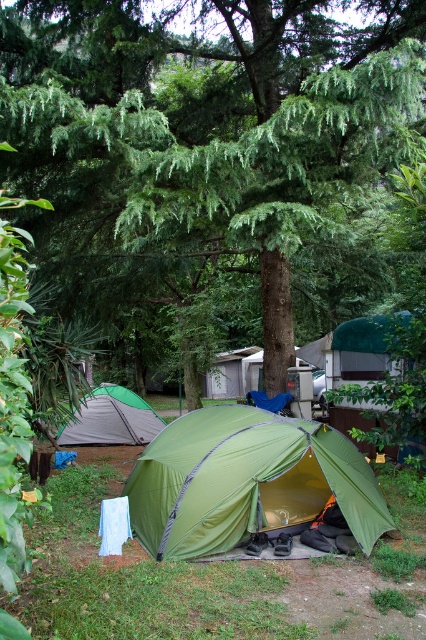
Question: From the image, what is the correct spatial relationship of green fabric tent at center in relation to green fabric tent at lower left?

Choices:
 (A) below
 (B) above

Answer: (B)

Question: Among these objects, which one is farthest from the camera?

Choices:
 (A) green leafy tree at center
 (B) green fabric tent at center
 (C) green fabric tent at lower left

Answer: (A)

Question: Which point is closer to the camera?

Choices:
 (A) green fabric tent at lower left
 (B) green fabric tent at center

Answer: (B)

Question: Considering the relative positions of green leafy tree at center and green fabric tent at lower left in the image provided, where is green leafy tree at center located with respect to green fabric tent at lower left?

Choices:
 (A) above
 (B) below

Answer: (A)

Question: Is green leafy tree at center thinner than green fabric tent at lower left?

Choices:
 (A) no
 (B) yes

Answer: (B)

Question: Estimate the real-world distances between objects in this image. Which object is closer to the green fabric tent at lower left?

Choices:
 (A) green fabric tent at center
 (B) green leafy tree at center

Answer: (B)